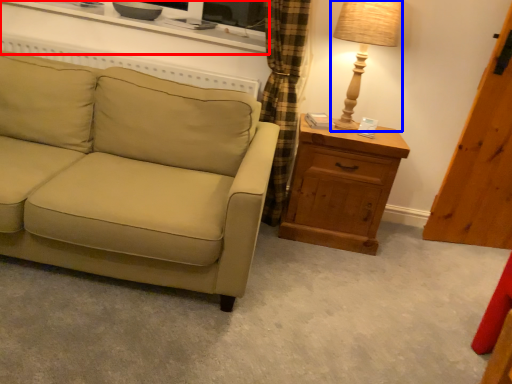
Question: Which of the following is the closest to the observer, entertainment center (highlighted by a red box) or table lamp (highlighted by a blue box)?

Choices:
 (A) entertainment center
 (B) table lamp

Answer: (B)